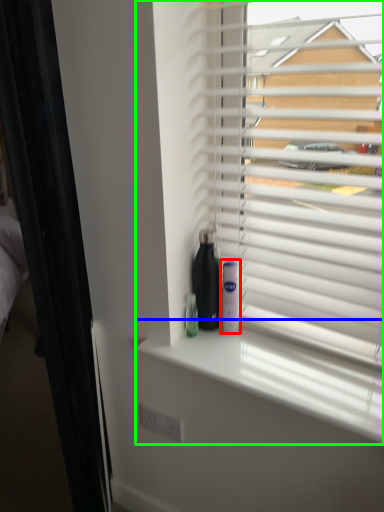
Question: Based on their relative distances, which object is farther from mouthwash (highlighted by a red box)? Choose from window sill (highlighted by a blue box) and window blind (highlighted by a green box).

Choices:
 (A) window sill
 (B) window blind

Answer: (B)